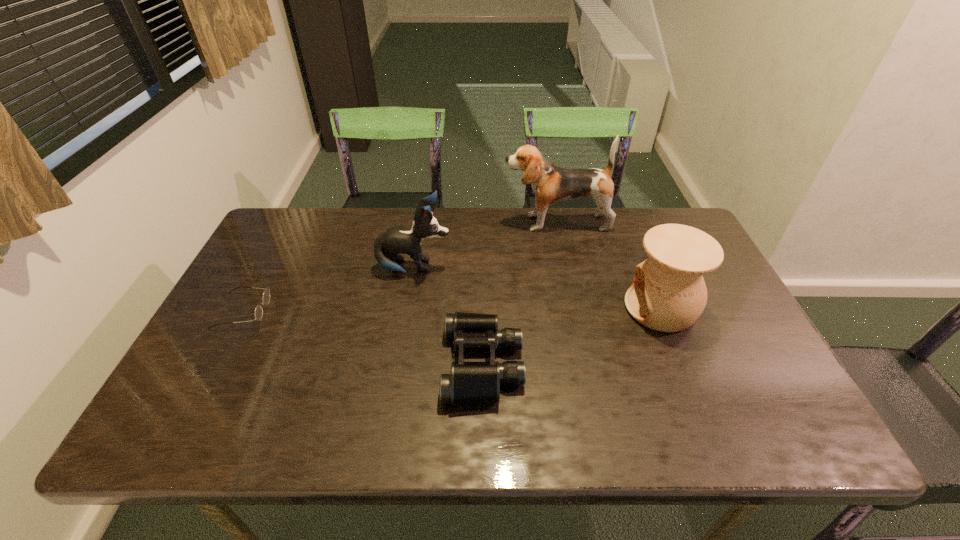
The width and height of the screenshot is (960, 540). In order to click on free space located at the face of the farthest object in this screenshot , I will do `click(469, 222)`.

In order to click on vacant area situated on the front-facing side of the nearer puppy in this screenshot , I will do `click(492, 268)`.

The image size is (960, 540). Find the location of `vacant space located 0.130m at the open side of the pottery`. vacant space located 0.130m at the open side of the pottery is located at coordinates (576, 308).

Find the location of a particular element. vacant region located at the open side of the pottery is located at coordinates (576, 308).

Identify the location of free spot located at the open side of the pottery. This screenshot has height=540, width=960. (516, 308).

You are a GUI agent. You are given a task and a screenshot of the screen. Output one action in this format:
    pyautogui.click(x=<x>, y=<y>)
    Task: Click on the free space located 0.350m on the front-facing side of the fourth tallest object
    This screenshot has width=960, height=540.
    Given the screenshot: What is the action you would take?
    click(x=296, y=364)

The width and height of the screenshot is (960, 540). What are the coordinates of `vacant position located 0.180m on the front-facing side of the fourth tallest object` in the screenshot? It's located at (368, 364).

Find the location of a particular element. This screenshot has width=960, height=540. free region located 0.290m on the front-facing side of the fourth tallest object is located at coordinates (321, 364).

Identify the location of vacant space located through the lenses of the leftmost object. The width and height of the screenshot is (960, 540). (289, 310).

Image resolution: width=960 pixels, height=540 pixels. What are the coordinates of `object that is at the far edge` in the screenshot? It's located at (551, 184).